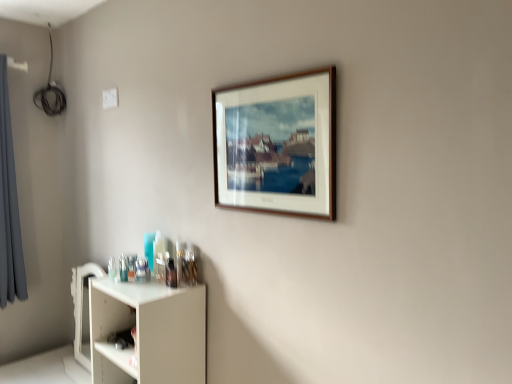
Where is `white matte shelf at lower left`? This screenshot has width=512, height=384. white matte shelf at lower left is located at coordinates (148, 332).

The width and height of the screenshot is (512, 384). Identify the location of gray fabric curtain at left. (9, 206).

The width and height of the screenshot is (512, 384). What do you see at coordinates (9, 206) in the screenshot?
I see `gray fabric curtain at left` at bounding box center [9, 206].

Locate an element on the screen. white matte shelf at lower left is located at coordinates (148, 332).

In order to click on shelf behind the wooden picture frame at upper center in this screenshot , I will do `click(148, 332)`.

From the image's perspective, is white matte shelf at lower left below wooden picture frame at upper center?

Yes.

Who is more distant, white matte shelf at lower left or wooden picture frame at upper center?

white matte shelf at lower left.

Based on the photo, which point is more forward, (136, 302) or (320, 199)?

The point (320, 199) is in front.

From the image's perspective, is wooden picture frame at upper center over gray fabric curtain at left?

Correct, wooden picture frame at upper center appears higher than gray fabric curtain at left in the image.

From the picture: Between wooden picture frame at upper center and gray fabric curtain at left, which one appears on the left side from the viewer's perspective?

From the viewer's perspective, gray fabric curtain at left appears more on the left side.

From a real-world perspective, is wooden picture frame at upper center on gray fabric curtain at left?

Yes, from a real-world perspective, wooden picture frame at upper center is on top of gray fabric curtain at left.

Is wooden picture frame at upper center thinner than gray fabric curtain at left?

Yes.

How distant is gray fabric curtain at left from wooden picture frame at upper center?

They are 5.49 feet apart.

In the scene shown: Which is more to the right, gray fabric curtain at left or wooden picture frame at upper center?

wooden picture frame at upper center.

Which point is more distant from viewer, (x=16, y=223) or (x=330, y=94)?

The point (x=16, y=223) is more distant.

From the picture: From a real-world perspective, is gray fabric curtain at left positioned above or below wooden picture frame at upper center?

gray fabric curtain at left is situated lower than wooden picture frame at upper center in the real world.

Between point (9, 206) and point (192, 352), which one is positioned behind?

The point (9, 206) is farther.

Who is bigger, gray fabric curtain at left or white matte shelf at lower left?

white matte shelf at lower left is bigger.

Between gray fabric curtain at left and white matte shelf at lower left, which one appears on the right side from the viewer's perspective?

Positioned to the right is white matte shelf at lower left.

Who is bigger, wooden picture frame at upper center or white matte shelf at lower left?

white matte shelf at lower left.

Which is in front, point (314, 153) or point (189, 314)?

The point (314, 153) is in front.

Could you tell me if wooden picture frame at upper center is turned towards white matte shelf at lower left?

No.

Is white matte shelf at lower left looking in the opposite direction of gray fabric curtain at left?

No, white matte shelf at lower left is not facing the opposite direction of gray fabric curtain at left.

Considering the sizes of objects white matte shelf at lower left and gray fabric curtain at left in the image provided, who is smaller, white matte shelf at lower left or gray fabric curtain at left?

Smaller between the two is gray fabric curtain at left.

Is white matte shelf at lower left placed right next to gray fabric curtain at left?

No.

Which is behind, point (181, 336) or point (2, 251)?

The point (2, 251) is behind.

Where is `picture frame that appears in front of the white matte shelf at lower left`? This screenshot has width=512, height=384. picture frame that appears in front of the white matte shelf at lower left is located at coordinates (277, 144).

The width and height of the screenshot is (512, 384). What are the coordinates of `picture frame on the right of gray fabric curtain at left` in the screenshot? It's located at (277, 144).

Considering their positions, is gray fabric curtain at left positioned closer to wooden picture frame at upper center than white matte shelf at lower left?

white matte shelf at lower left lies closer to wooden picture frame at upper center than the other object.

Looking at this image, when comparing their distances from white matte shelf at lower left, does gray fabric curtain at left or wooden picture frame at upper center seem closer?

wooden picture frame at upper center is positioned closer to the anchor white matte shelf at lower left.

From the image, which object appears to be nearer to wooden picture frame at upper center, white matte shelf at lower left or gray fabric curtain at left?

white matte shelf at lower left is closer to wooden picture frame at upper center.

Which object lies nearer to the anchor point gray fabric curtain at left, white matte shelf at lower left or wooden picture frame at upper center?

white matte shelf at lower left is closer to gray fabric curtain at left.

Considering their positions, is wooden picture frame at upper center positioned further to white matte shelf at lower left than gray fabric curtain at left?

gray fabric curtain at left.

Considering their positions, is wooden picture frame at upper center positioned closer to gray fabric curtain at left than white matte shelf at lower left?

white matte shelf at lower left is closer to gray fabric curtain at left.

Where is `shelf located between gray fabric curtain at left and wooden picture frame at upper center in the left-right direction`? The height and width of the screenshot is (384, 512). shelf located between gray fabric curtain at left and wooden picture frame at upper center in the left-right direction is located at coordinates (148, 332).